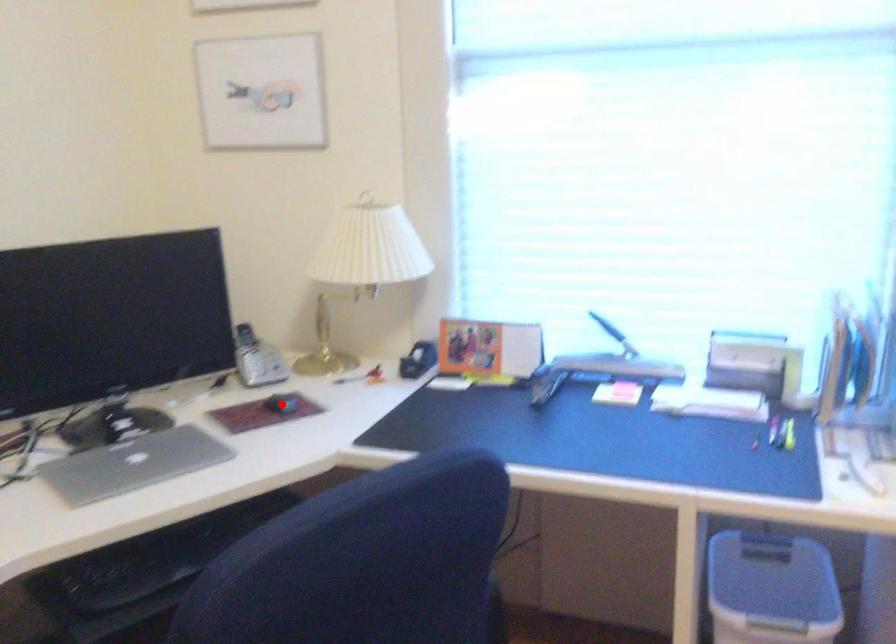
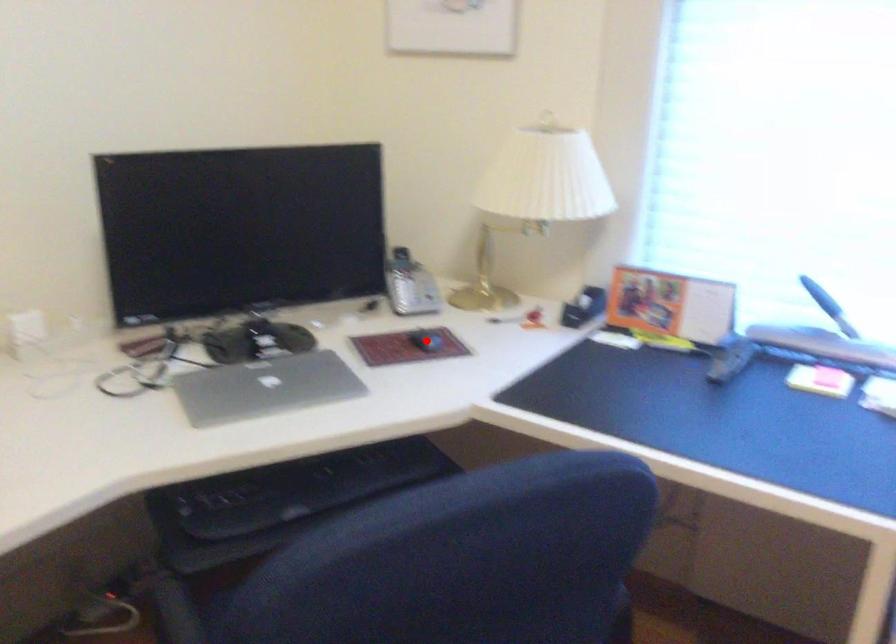
I am providing you with two images of the same scene from different viewpoints. A red point is marked on the first image and another point is marked on the second image. Do the highlighted points in image1 and image2 indicate the same real-world spot?

Yes